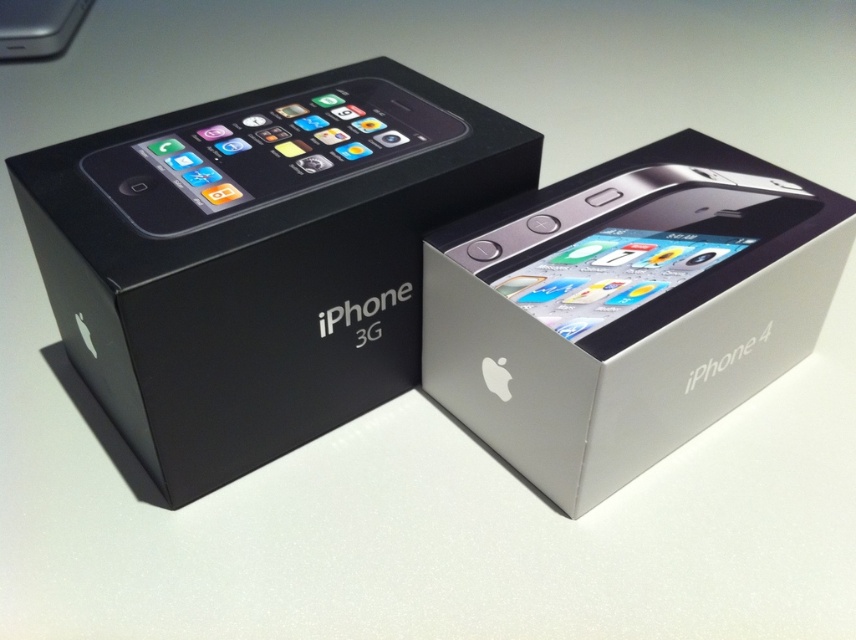
Based on the photo, you are trying to fit both the silver metallic iPhone 4 at center and the matte black iPhone at upper left into a narrow drawer. Based on their sizes, which one is more likely to fit through the drawer opening first?

The matte black iPhone at upper left is more likely to fit through the drawer opening first since it might be narrower than the silver metallic iPhone 4 at center according to the description.

You are a delivery person who needs to place a new package between the silver metallic iPhone 4 at center and the silver metallic iPod at upper left. The package is 1.3 meters long. Will it fit in the space between them?

The distance between the silver metallic iPhone 4 at center and the silver metallic iPod at upper left is 1.40 meters. Since the package is 1.3 meters long, it will fit in the space between them.